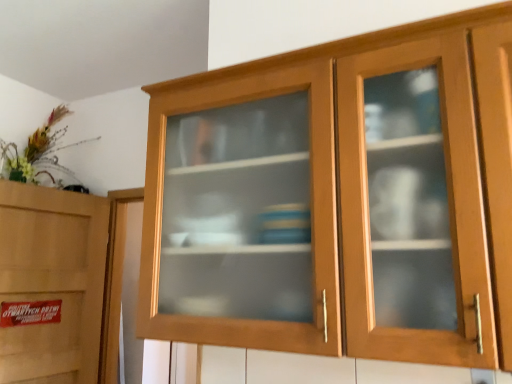
Question: Is matte wood cabinet at left positioned with its back to wooden cabinet at center?

Choices:
 (A) yes
 (B) no

Answer: (B)

Question: From a real-world perspective, is matte wood cabinet at left located higher than wooden cabinet at center?

Choices:
 (A) no
 (B) yes

Answer: (A)

Question: Does matte wood cabinet at left have a larger size compared to wooden cabinet at center?

Choices:
 (A) yes
 (B) no

Answer: (B)

Question: Is matte wood cabinet at left not inside wooden cabinet at center?

Choices:
 (A) yes
 (B) no

Answer: (A)

Question: Considering the relative positions of matte wood cabinet at left and wooden cabinet at center in the image provided, is matte wood cabinet at left behind wooden cabinet at center?

Choices:
 (A) yes
 (B) no

Answer: (A)

Question: Does matte wood cabinet at left turn towards wooden cabinet at center?

Choices:
 (A) no
 (B) yes

Answer: (B)

Question: Is wooden cabinet at center aimed at matte wood cabinet at left?

Choices:
 (A) no
 (B) yes

Answer: (A)

Question: Is wooden cabinet at center not close to matte wood cabinet at left?

Choices:
 (A) yes
 (B) no

Answer: (A)

Question: Is wooden cabinet at center in contact with matte wood cabinet at left?

Choices:
 (A) yes
 (B) no

Answer: (B)

Question: Is matte wood cabinet at left inside wooden cabinet at center?

Choices:
 (A) no
 (B) yes

Answer: (A)

Question: From the image's perspective, is wooden cabinet at center above matte wood cabinet at left?

Choices:
 (A) no
 (B) yes

Answer: (B)

Question: From the image's perspective, is wooden cabinet at center located beneath matte wood cabinet at left?

Choices:
 (A) no
 (B) yes

Answer: (A)

Question: In the image, is wooden cabinet at center positioned in front of or behind matte wood cabinet at left?

Choices:
 (A) behind
 (B) front

Answer: (B)